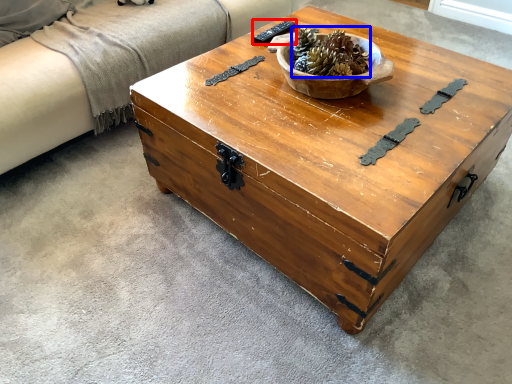
Question: Which object is closer to the camera taking this photo, remote (highlighted by a red box) or centerpiece (highlighted by a blue box)?

Choices:
 (A) remote
 (B) centerpiece

Answer: (B)